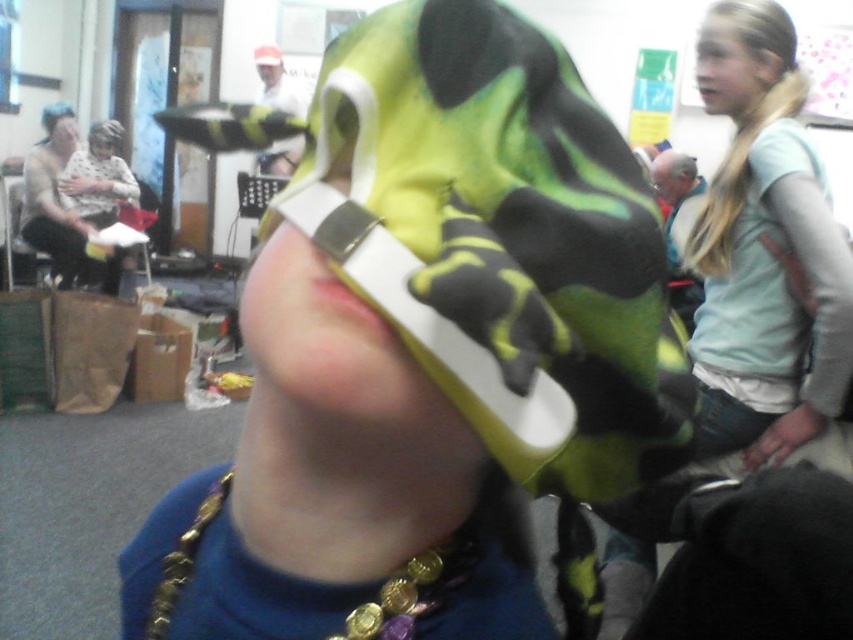
Does green camouflage hat at center have a greater width compared to blonde hair at upper right?

Yes, green camouflage hat at center is wider than blonde hair at upper right.

Is green camouflage hat at center bigger than blonde hair at upper right?

Correct, green camouflage hat at center is larger in size than blonde hair at upper right.

Who is more forward, (389, 250) or (755, 8)?

Point (389, 250) is in front.

You are a GUI agent. You are given a task and a screenshot of the screen. Output one action in this format:
    pyautogui.click(x=<x>, y=<y>)
    Task: Click on the green camouflage hat at center
    
    Given the screenshot: What is the action you would take?
    pyautogui.click(x=492, y=240)

Which of these two, smooth skin face at upper right or matte black mask at upper center, stands shorter?

smooth skin face at upper right is shorter.

Measure the distance between smooth skin face at upper right and matte black mask at upper center.

smooth skin face at upper right and matte black mask at upper center are 7.96 feet apart.

The image size is (853, 640). Identify the location of smooth skin face at upper right. (728, 68).

Is gray fabric jacket at right shorter than matte black mask at upper center?

No.

Can you confirm if gray fabric jacket at right is positioned below matte black mask at upper center?

Yes.

Between point (664, 179) and point (669, 168), which one is positioned in front?

Positioned in front is point (664, 179).

Where is `gray fabric jacket at right`? gray fabric jacket at right is located at coordinates (679, 225).